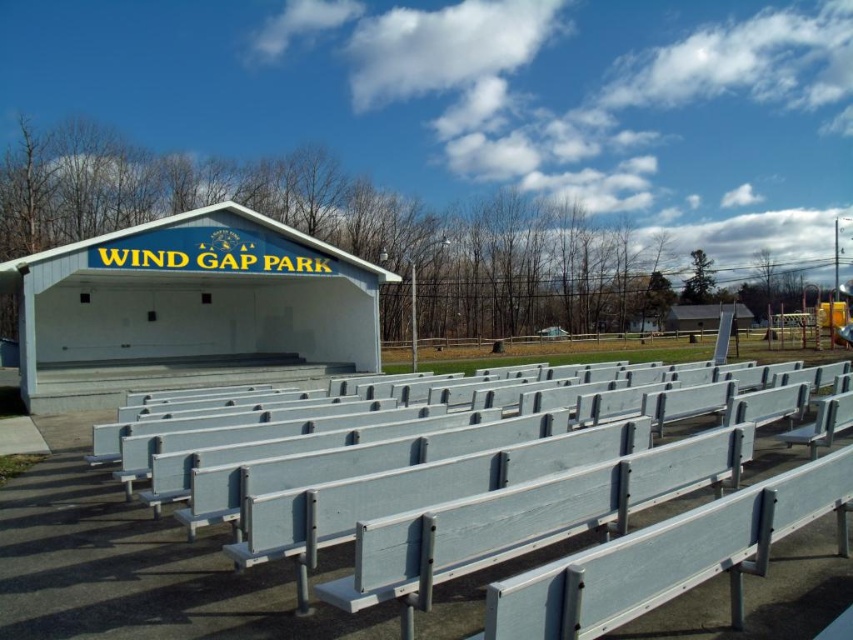
You are planning to set up a small picnic basket on the white painted wood bench at lower center and the white matte shelter at upper center. Which surface can accommodate the picnic basket more comfortably?

The white matte shelter at upper center has a greater width than the white painted wood bench at lower center, so it can accommodate the picnic basket more comfortably.

You are attending an outdoor event at Wind Gap Park and need to find a place to sit. You see a white painted wood bench at lower center and a white matte shelter at upper center. Which object is shorter in height?

The white painted wood bench at lower center is not as tall as the white matte shelter at upper center, so the bench is shorter in height.

You are standing at the entrance of the outdoor amphitheater at Wind Gap Park. You see a point marked at coordinates (457, 499). What object is located at this point?

The point at coordinates (457, 499) corresponds to the white painted wood bench at lower center.